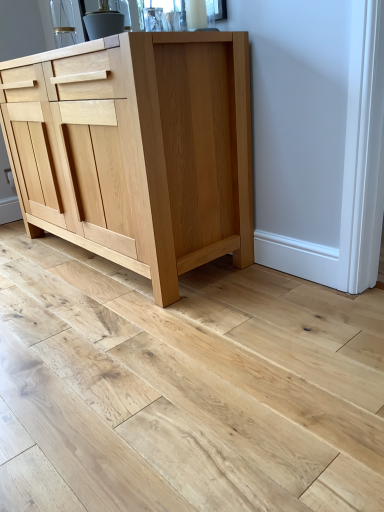
You are a GUI agent. You are given a task and a screenshot of the screen. Output one action in this format:
    pyautogui.click(x=<x>, y=<y>)
    Task: Click on the natural wood cabinet at center
    The image size is (384, 512).
    Given the screenshot: What is the action you would take?
    pyautogui.click(x=138, y=150)

What do you see at coordinates (138, 150) in the screenshot? I see `natural wood cabinet at center` at bounding box center [138, 150].

Identify the location of natural wood cabinet at center. (138, 150).